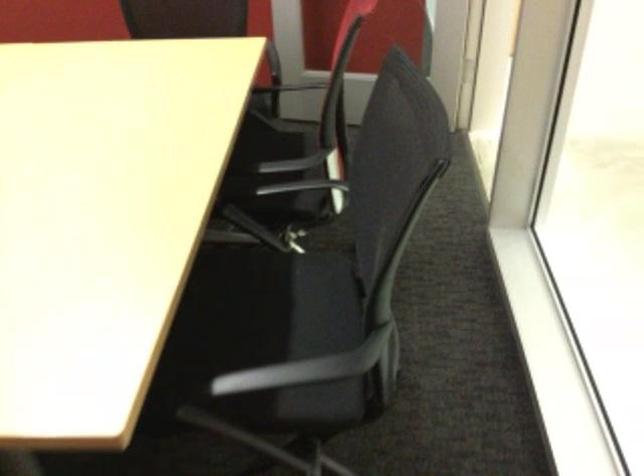
You are a GUI agent. You are given a task and a screenshot of the screen. Output one action in this format:
    pyautogui.click(x=<x>, y=<y>)
    Task: Click on the chair sitting surface
    
    Given the screenshot: What is the action you would take?
    pos(234,308)